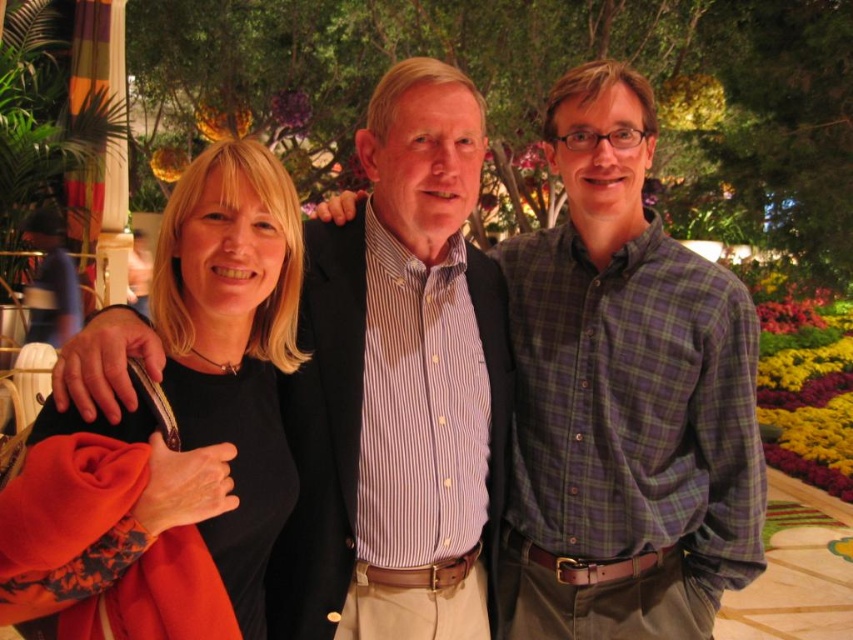
What is the color of the shirt at the point specified by the coordinates (624, 397)?

The point at coordinates (624, 397) is on the purple flannel shirt at center, so the color is purple.

You are a photographer trying to capture a group photo of the purple flannel shirt at center and the black matte shirt at left. Since you want to ensure both subjects are clearly visible, which subject should you focus on first to account for their size difference?

The photographer should focus on the purple flannel shirt at center first because it is larger than the black matte shirt at left, ensuring the bigger subject is in focus before adjusting for the smaller one.

You are a photographer trying to arrange the subjects in the image so that the black matte shirt at left is positioned to the left of the purple flannel shirt at center. Is the current arrangement already meeting this requirement?

Yes, the current arrangement already meets the requirement because the purple flannel shirt at center is to the right of the black matte shirt at left, which means the black matte shirt at left is positioned to the left of the purple flannel shirt at center.